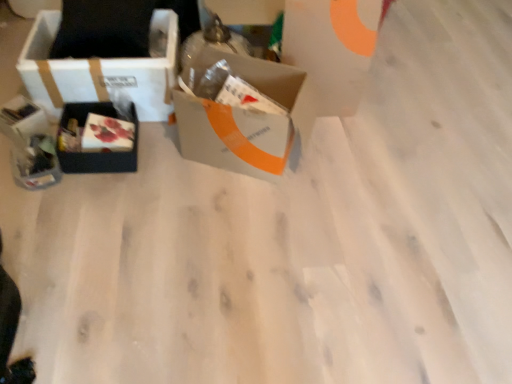
This screenshot has width=512, height=384. In order to click on vacant space in front of white cardboard box at upper center in this screenshot , I will do `click(339, 140)`.